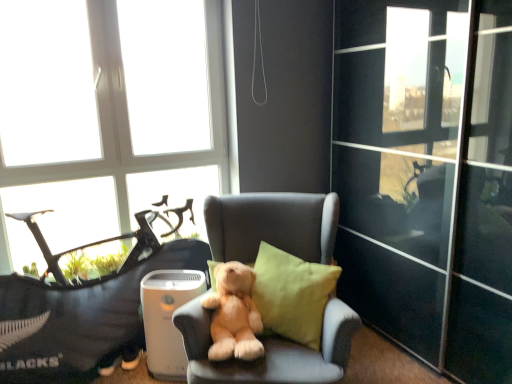
Question: Considering the positions of soft gray armchair at center and linen cushion at center in the image, is soft gray armchair at center taller or shorter than linen cushion at center?

Choices:
 (A) short
 (B) tall

Answer: (B)

Question: Considering their positions, is soft gray armchair at center located in front of or behind linen cushion at center?

Choices:
 (A) behind
 (B) front

Answer: (B)

Question: Considering the real-world distances, which object is closest to the soft fabric teddy bear at center?

Choices:
 (A) linen cushion at center
 (B) transparent glass window at upper left
 (C) soft gray armchair at center
 (D) soft plush bear at center

Answer: (B)

Question: Estimate the real-world distances between objects in this image. Which object is farther from the soft gray armchair at center?

Choices:
 (A) transparent glass window at upper left
 (B) linen cushion at center
 (C) soft fabric teddy bear at center
 (D) soft plush bear at center

Answer: (A)